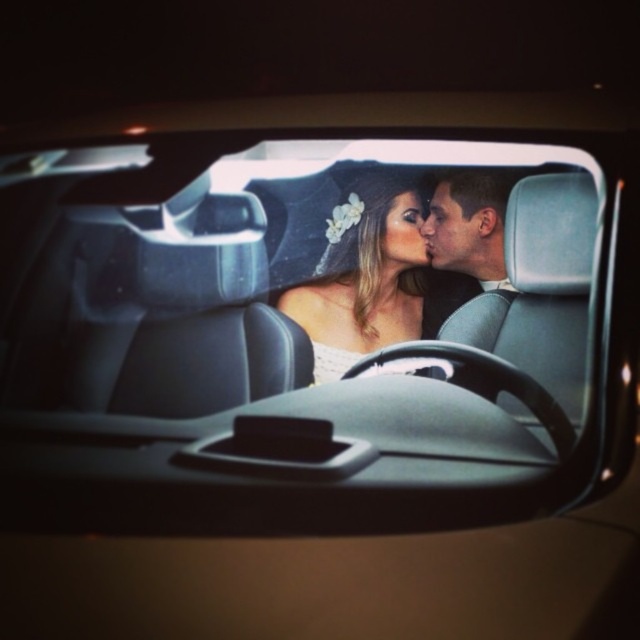
Question: Which point is farther to the camera?

Choices:
 (A) (449, 212)
 (B) (420, 307)

Answer: (B)

Question: Considering the relative positions of white satin dress at center and matte black hair at center in the image provided, where is white satin dress at center located with respect to matte black hair at center?

Choices:
 (A) above
 (B) below

Answer: (B)

Question: Which object appears farthest from the camera in this image?

Choices:
 (A) matte black hair at center
 (B) white satin dress at center

Answer: (B)

Question: Does white satin dress at center have a lesser width compared to matte black hair at center?

Choices:
 (A) no
 (B) yes

Answer: (A)

Question: Which point is closer to the camera?

Choices:
 (A) (317, 280)
 (B) (481, 321)

Answer: (B)

Question: Can you confirm if white satin dress at center is positioned above matte black hair at center?

Choices:
 (A) no
 (B) yes

Answer: (A)